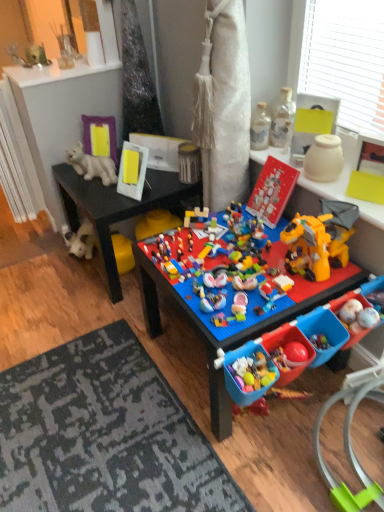
Question: From the image's perspective, does metallic can at center, arranged as the 3th toy when viewed from the left, appear lower than brick-like plastic lego set at center, which is counted as the fourth toy, starting from the left?

Choices:
 (A) yes
 (B) no

Answer: (B)

Question: Is metallic can at center, which ranks as the 5th toy in right-to-left order, turned away from brick-like plastic lego set at center, arranged as the fourth toy when viewed from the right?

Choices:
 (A) yes
 (B) no

Answer: (B)

Question: Is brick-like plastic lego set at center, arranged as the fourth toy when viewed from the right, completely or partially inside metallic can at center, arranged as the 3th toy when viewed from the left?

Choices:
 (A) yes
 (B) no

Answer: (B)

Question: From a real-world perspective, is metallic can at center, which ranks as the 5th toy in right-to-left order, physically below brick-like plastic lego set at center, arranged as the fourth toy when viewed from the right?

Choices:
 (A) no
 (B) yes

Answer: (A)

Question: Is metallic can at center, arranged as the 3th toy when viewed from the left, thinner than brick-like plastic lego set at center, arranged as the fourth toy when viewed from the right?

Choices:
 (A) no
 (B) yes

Answer: (B)

Question: Does metallic can at center, which ranks as the 5th toy in right-to-left order, appear on the right side of brick-like plastic lego set at center, which is counted as the fourth toy, starting from the left?

Choices:
 (A) yes
 (B) no

Answer: (B)

Question: Is blue plastic table at center shorter than white matte vase at upper right, the first toy from the right?

Choices:
 (A) yes
 (B) no

Answer: (B)

Question: Is white matte vase at upper right, marked as the 7th toy in a left-to-right arrangement, at the back of blue plastic table at center?

Choices:
 (A) yes
 (B) no

Answer: (B)

Question: Would you say blue plastic table at center contains white matte vase at upper right, marked as the 7th toy in a left-to-right arrangement?

Choices:
 (A) yes
 (B) no

Answer: (B)

Question: Is blue plastic table at center thinner than white matte vase at upper right, the first toy from the right?

Choices:
 (A) yes
 (B) no

Answer: (B)

Question: From the image's perspective, does blue plastic table at center appear lower than white matte vase at upper right, marked as the 7th toy in a left-to-right arrangement?

Choices:
 (A) yes
 (B) no

Answer: (A)

Question: Is blue plastic table at center not near white matte vase at upper right, the first toy from the right?

Choices:
 (A) no
 (B) yes

Answer: (A)

Question: From the image's perspective, is blue plastic table at center on top of clear glass bottle at upper right, the fifth toy when ordered from left to right?

Choices:
 (A) yes
 (B) no

Answer: (B)